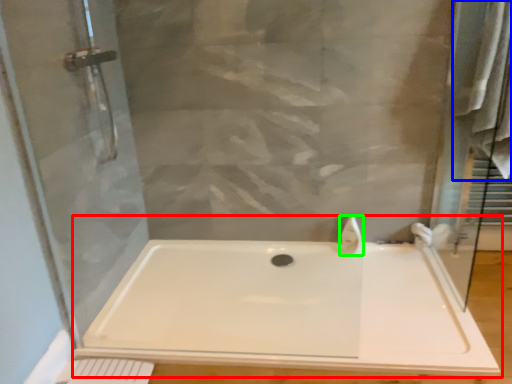
Question: Based on their relative distances, which object is nearer to bathtub (highlighted by a red box)? Choose from bath towel (highlighted by a blue box) and faucet (highlighted by a green box).

Choices:
 (A) bath towel
 (B) faucet

Answer: (B)